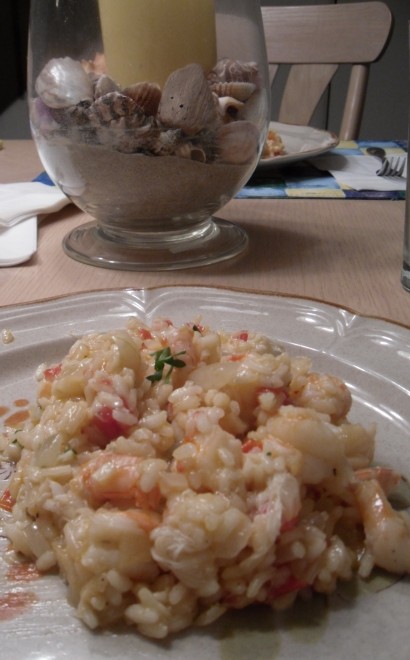
Where is `plates`? Image resolution: width=410 pixels, height=660 pixels. plates is located at coordinates (305, 132), (340, 348).